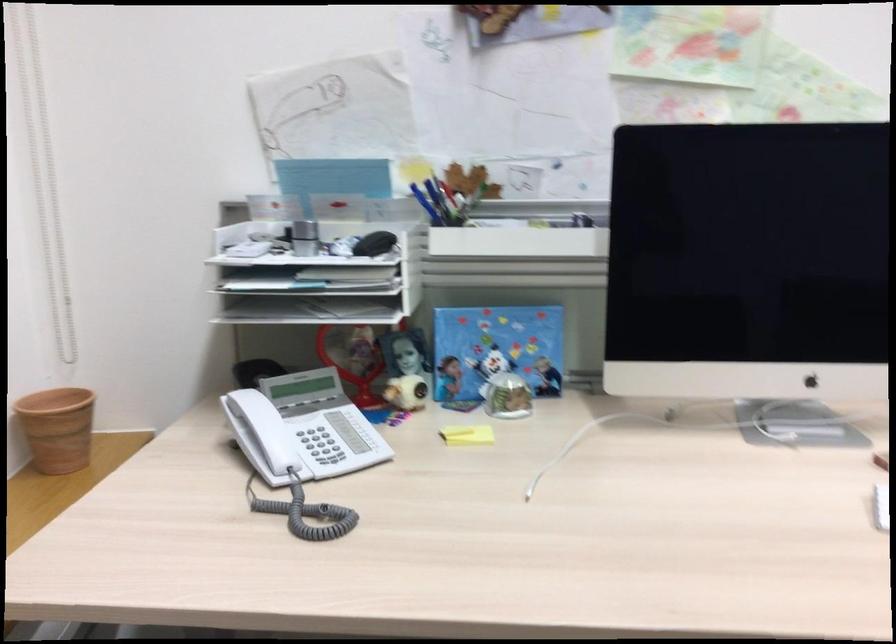
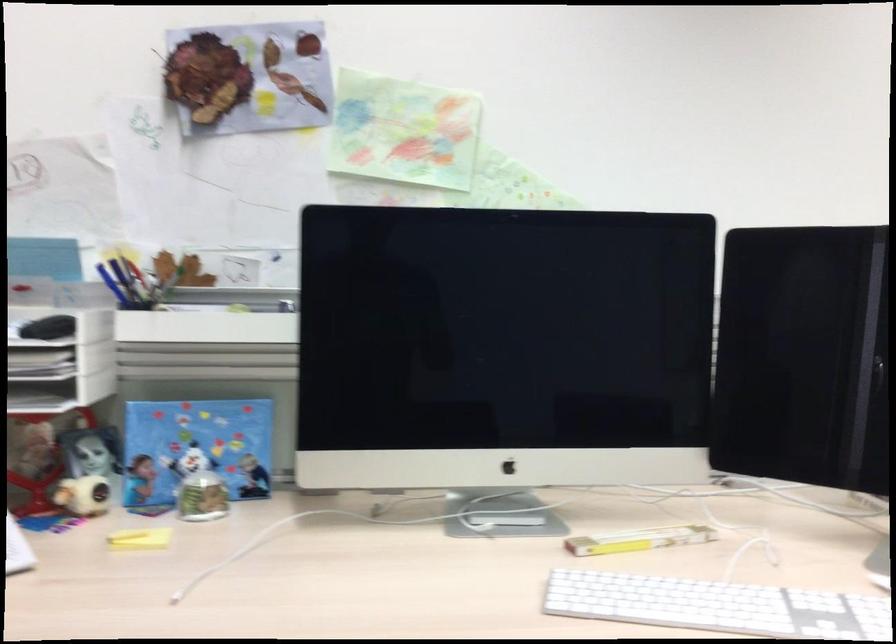
The point at (467, 433) is marked in the first image. Where is the corresponding point in the second image?

(140, 538)